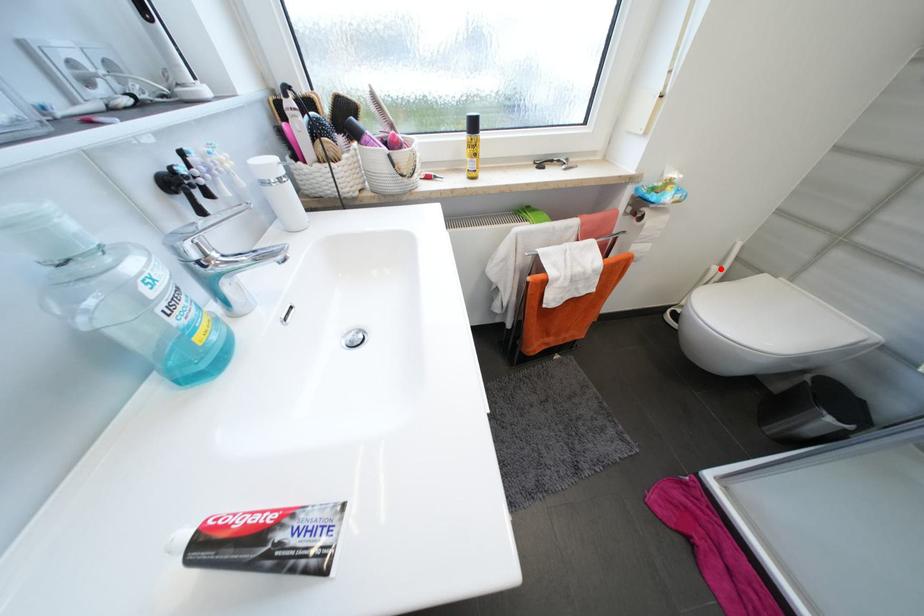
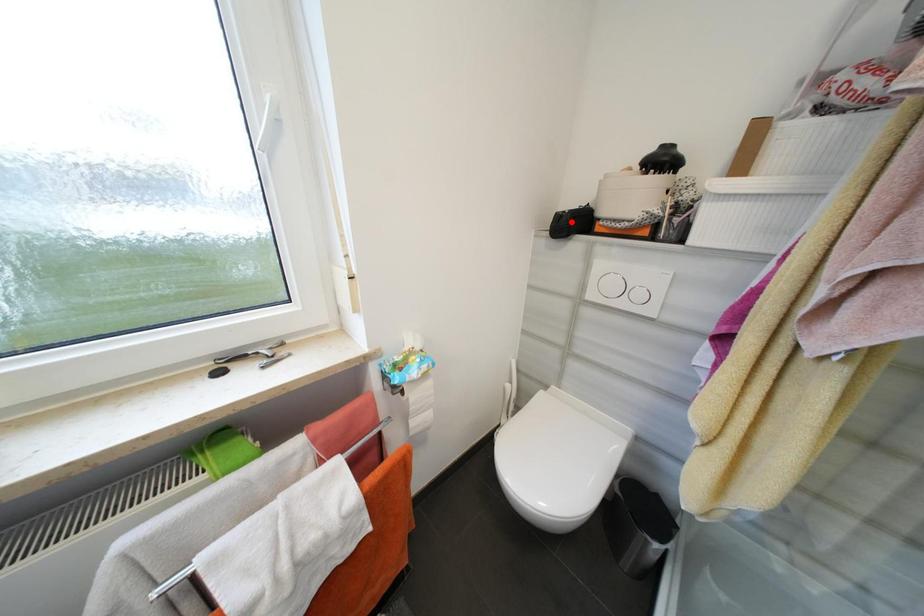
I am providing you with two images of the same scene from different viewpoints. A red point is marked on the first image and another point is marked on the second image. Does the point marked in image1 correspond to the same location as the one in image2?

No